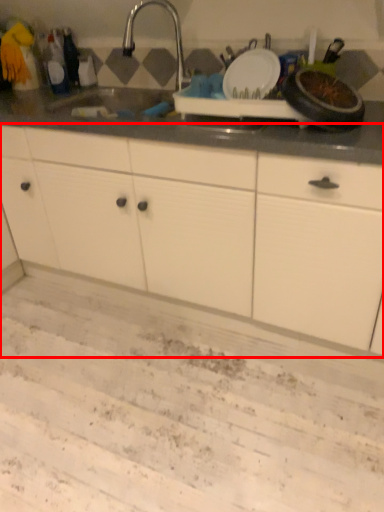
Question: Considering the relative positions of cabinetry (annotated by the red box) and tap in the image provided, where is cabinetry (annotated by the red box) located with respect to the staircase?

Choices:
 (A) right
 (B) left

Answer: (A)